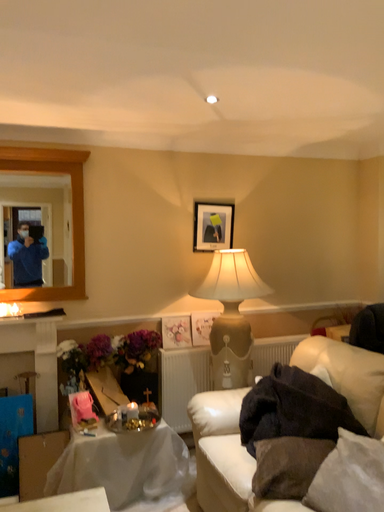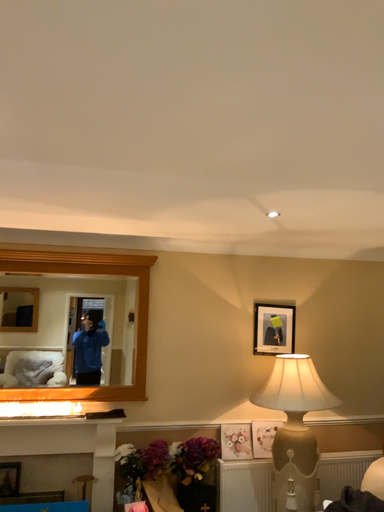
Question: How did the camera likely rotate when shooting the video?

Choices:
 (A) rotated right
 (B) rotated left

Answer: (B)